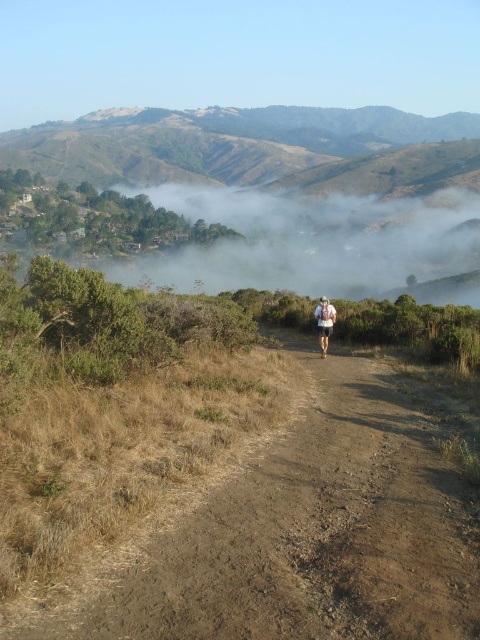
Based on the photo, measure the distance between point (175,522) and camera.

The distance of point (175,522) from camera is 6.16 meters.

Is brown dirt track at center to the right of white fabric at center from the viewer's perspective?

No, brown dirt track at center is not to the right of white fabric at center.

Between point (280, 460) and point (317, 324), which one is positioned behind?

The point (317, 324) is more distant.

Where is `brown dirt track at center`? The height and width of the screenshot is (640, 480). brown dirt track at center is located at coordinates (305, 534).